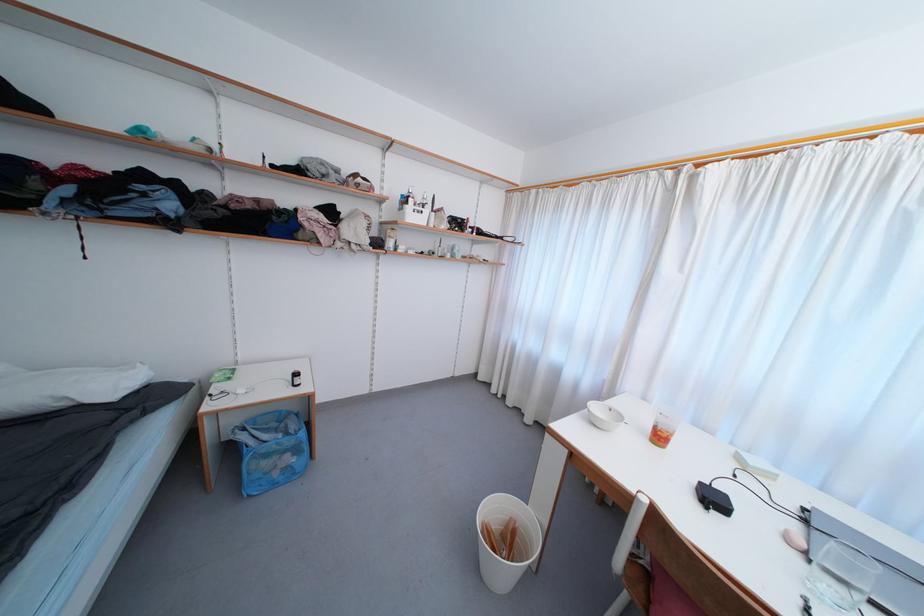
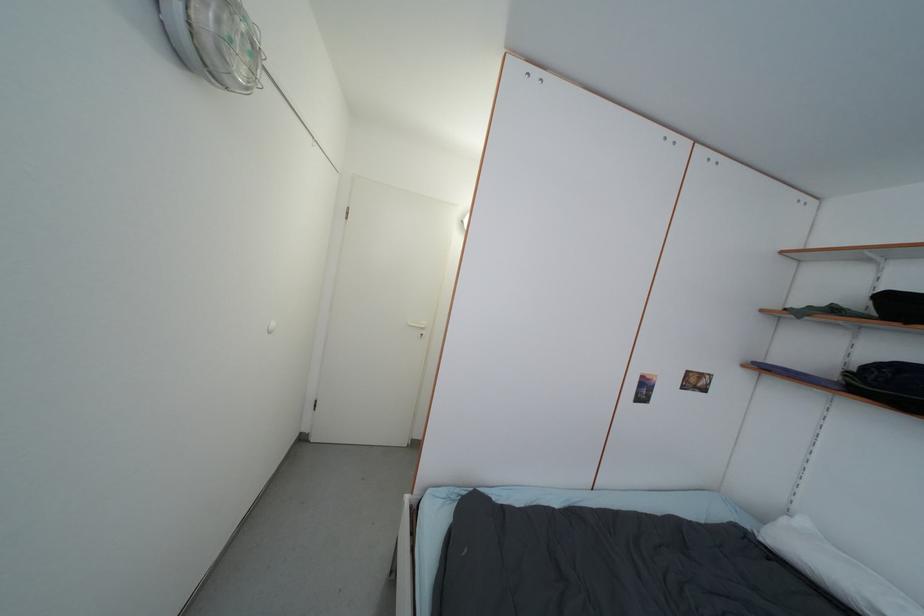
Question: Based on the continuous images, in which direction is the camera rotating? Reply with the corresponding letter.

Choices:
 (A) Left
 (B) Right
 (C) Up
 (D) Down

Answer: (A)